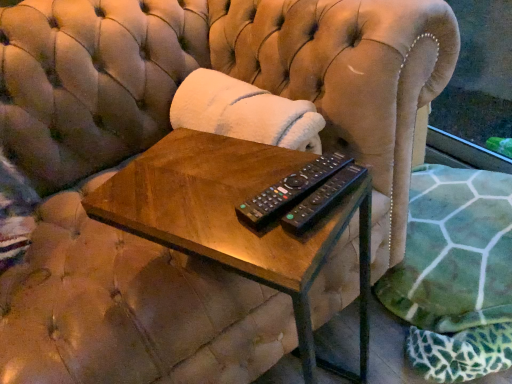
Question: Is woodenmaterial/texturetable at center inside black plastic remote at center, the first remote control from the back?

Choices:
 (A) no
 (B) yes

Answer: (A)

Question: Does black plastic remote at center, which appears as the 2th remote control when viewed from the front, have a lesser height compared to woodenmaterial/texturetable at center?

Choices:
 (A) no
 (B) yes

Answer: (B)

Question: Could you tell me if black plastic remote at center, which appears as the 2th remote control when viewed from the front, is facing woodenmaterial/texturetable at center?

Choices:
 (A) yes
 (B) no

Answer: (B)

Question: Is black plastic remote at center, which appears as the 2th remote control when viewed from the front, thinner than woodenmaterial/texturetable at center?

Choices:
 (A) no
 (B) yes

Answer: (B)

Question: Can you confirm if black plastic remote at center, which appears as the 2th remote control when viewed from the front, is bigger than woodenmaterial/texturetable at center?

Choices:
 (A) yes
 (B) no

Answer: (B)

Question: Can you see black plastic remote at center, the first remote control from the back, touching woodenmaterial/texturetable at center?

Choices:
 (A) yes
 (B) no

Answer: (B)

Question: Considering the relative positions of black plastic remote at center, the second remote control viewed from the back, and black plastic remote at center, which appears as the 2th remote control when viewed from the front, in the image provided, is black plastic remote at center, the second remote control viewed from the back, in front of black plastic remote at center, which appears as the 2th remote control when viewed from the front,?

Choices:
 (A) no
 (B) yes

Answer: (B)

Question: Considering the relative positions of black plastic remote at center, the first remote control positioned from the front, and black plastic remote at center, which appears as the 2th remote control when viewed from the front, in the image provided, is black plastic remote at center, the first remote control positioned from the front, to the left of black plastic remote at center, which appears as the 2th remote control when viewed from the front, from the viewer's perspective?

Choices:
 (A) yes
 (B) no

Answer: (B)

Question: Is black plastic remote at center, the first remote control positioned from the front, taller than black plastic remote at center, the first remote control from the back?

Choices:
 (A) yes
 (B) no

Answer: (B)

Question: From a real-world perspective, is black plastic remote at center, the first remote control positioned from the front, physically above black plastic remote at center, which appears as the 2th remote control when viewed from the front?

Choices:
 (A) no
 (B) yes

Answer: (B)

Question: Is black plastic remote at center, the second remote control viewed from the back, turned away from black plastic remote at center, which appears as the 2th remote control when viewed from the front?

Choices:
 (A) yes
 (B) no

Answer: (B)

Question: Is black plastic remote at center, the first remote control positioned from the front, wider than black plastic remote at center, which appears as the 2th remote control when viewed from the front?

Choices:
 (A) no
 (B) yes

Answer: (A)

Question: From a real-world perspective, is black plastic remote at center, the second remote control viewed from the back, positioned over woodenmaterial/texturetable at center based on gravity?

Choices:
 (A) no
 (B) yes

Answer: (B)